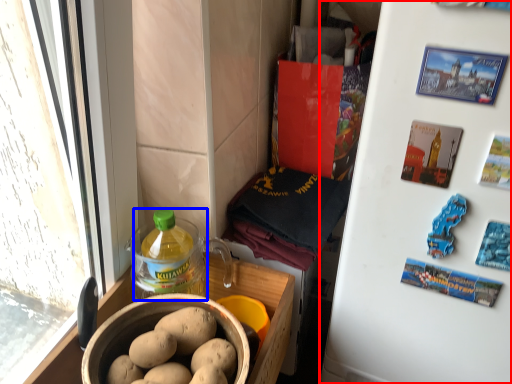
Question: Which object is closer to the camera taking this photo, refrigerator (highlighted by a red box) or bottle (highlighted by a blue box)?

Choices:
 (A) refrigerator
 (B) bottle

Answer: (A)